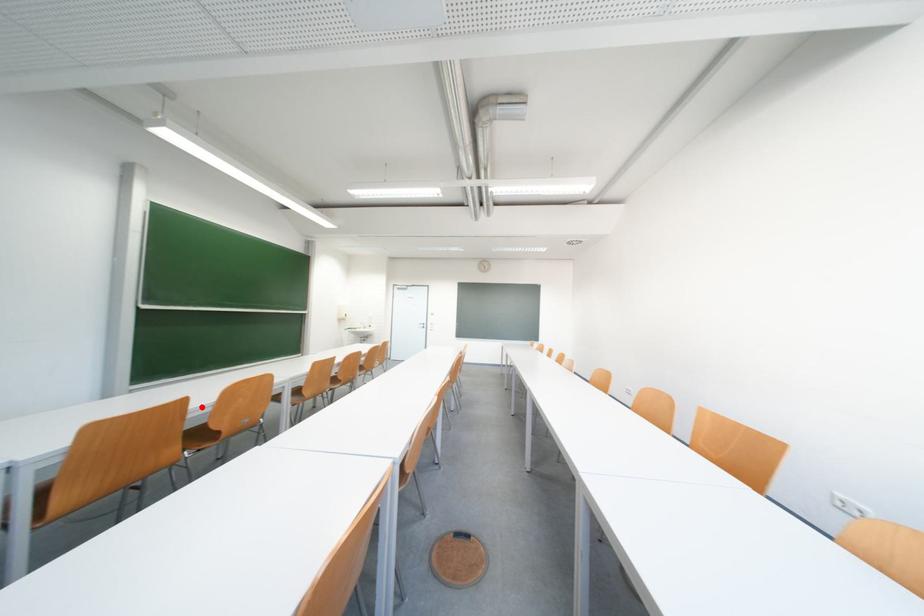
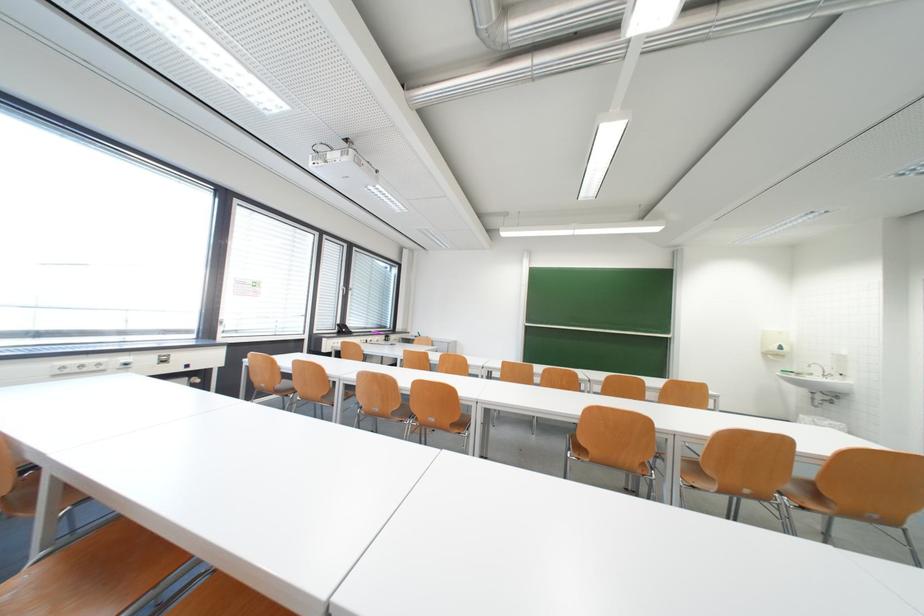
Find the pixel in the second image that matches the highlighted location in the first image.

(439, 359)